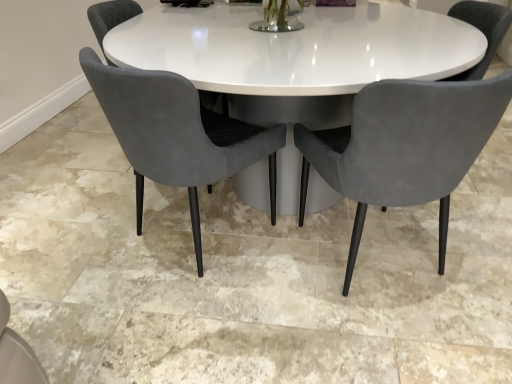
The width and height of the screenshot is (512, 384). I want to click on free space to the left of velvet grey chair at center, which ranks as the second chair in right-to-left order, so click(76, 238).